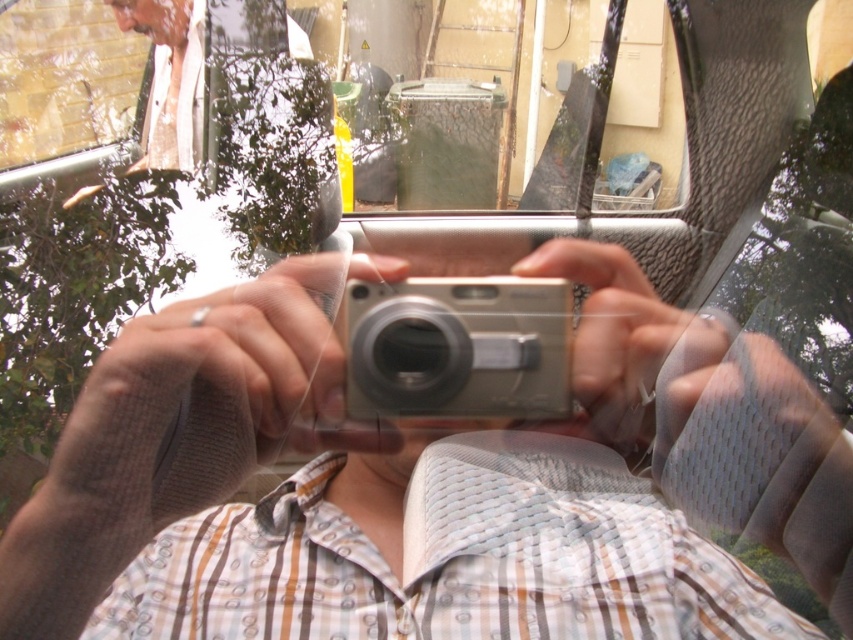
I want to click on white textured shirt at center, so click(450, 560).

Is white textured shirt at center smaller than silver metallic camera at center?

Incorrect, white textured shirt at center is not smaller in size than silver metallic camera at center.

Is point (167, 566) less distant than point (431, 416)?

No, (167, 566) is further to viewer.

The image size is (853, 640). In order to click on white textured shirt at center in this screenshot , I will do `click(450, 560)`.